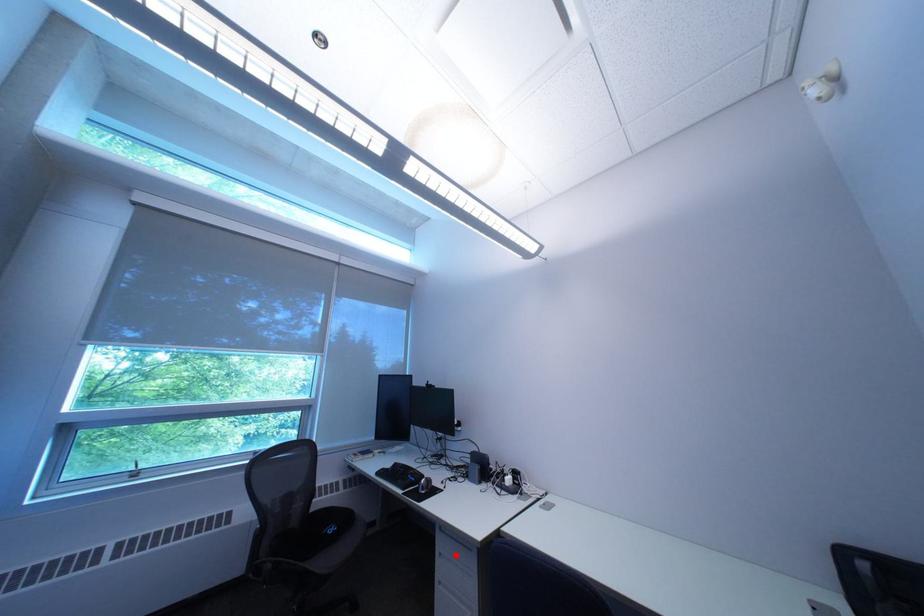
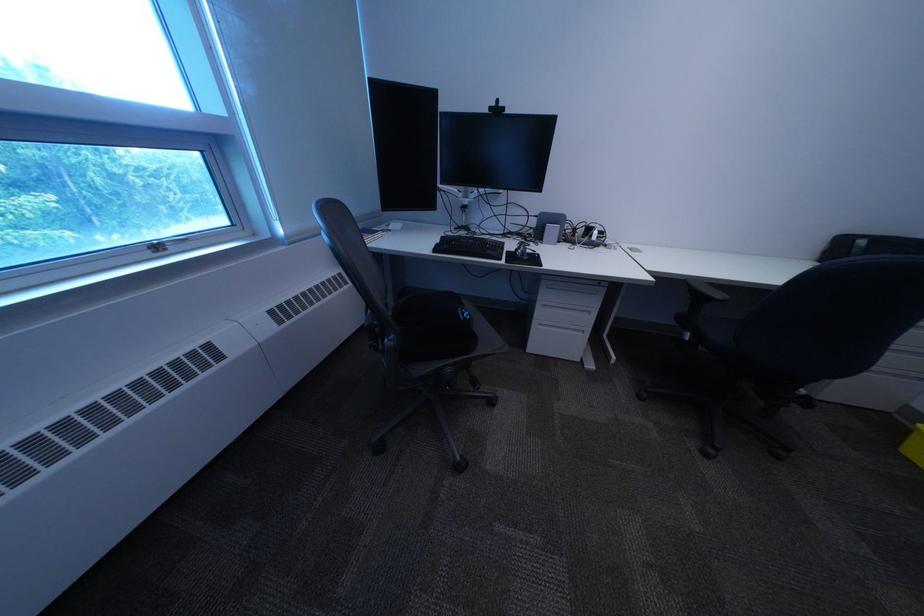
In the second image, find the point that corresponds to the highlighted location in the first image.

(558, 307)